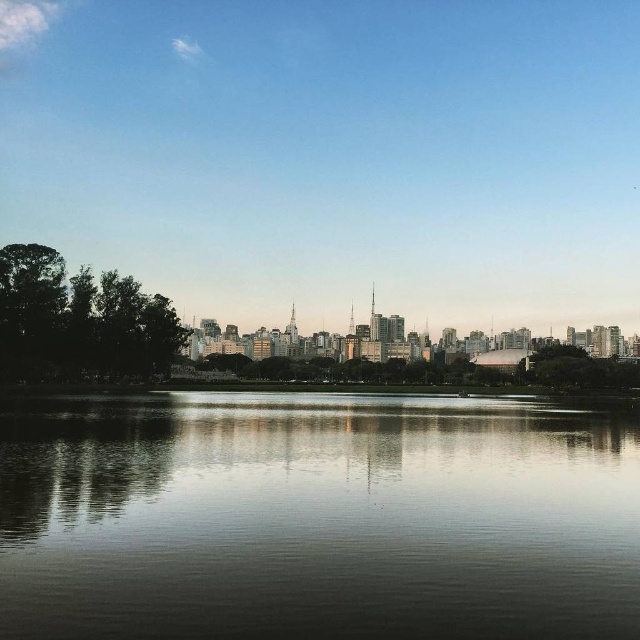
Consider the image. Does smooth reflective water at center have a larger size compared to green leafy tree at right?

No.

Is smooth reflective water at center smaller than green leafy tree at right?

Correct, smooth reflective water at center occupies less space than green leafy tree at right.

Who is more distant from viewer, (138, 604) or (532, 362)?

Positioned behind is point (532, 362).

I want to click on smooth reflective water at center, so click(317, 518).

Is point (124, 560) closer to camera compared to point (10, 320)?

Yes.

At what (x,y) coordinates should I click in order to perform the action: click on smooth reflective water at center. Please return your answer as a coordinate pair (x, y). Looking at the image, I should click on (317, 518).

Does green leafy trees at left have a larger size compared to green leafy tree at right?

Actually, green leafy trees at left might be smaller than green leafy tree at right.

Is green leafy trees at left to the left of green leafy tree at right from the viewer's perspective?

Correct, you'll find green leafy trees at left to the left of green leafy tree at right.

At what (x,y) coordinates should I click in order to perform the action: click on green leafy trees at left. Please return your answer as a coordinate pair (x, y). Looking at the image, I should click on (80, 320).